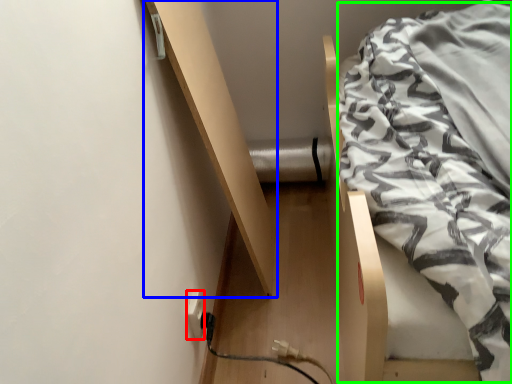
Question: Based on their relative distances, which object is nearer to electric outlet (highlighted by a red box)? Choose from shelf (highlighted by a blue box) and blanket (highlighted by a green box).

Choices:
 (A) shelf
 (B) blanket

Answer: (A)